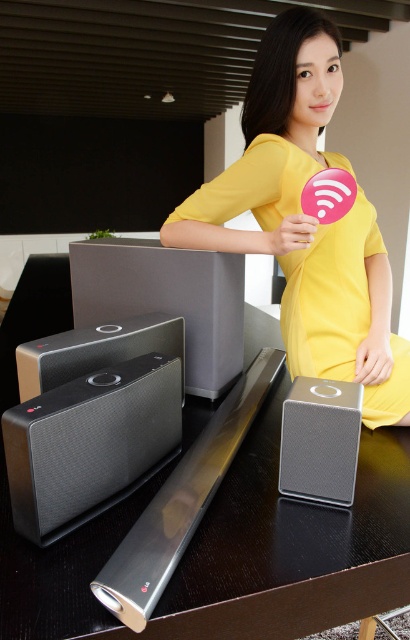
You are organizing an event and need to determine if the yellow fabric dress at center can be placed on top of the matte black speaker at lower left without falling off. Based on their sizes, is this feasible?

The yellow fabric dress at center is larger in size than the matte black speaker at lower left, so placing it on top might not be stable and could cause it to fall off.

You are standing in front of the dark wooden table with the LG audio equipment. There is a point marked at coordinates (166, 300). What object is located at that point?

The point at coordinates (166, 300) indicates the matte black speaker at center.